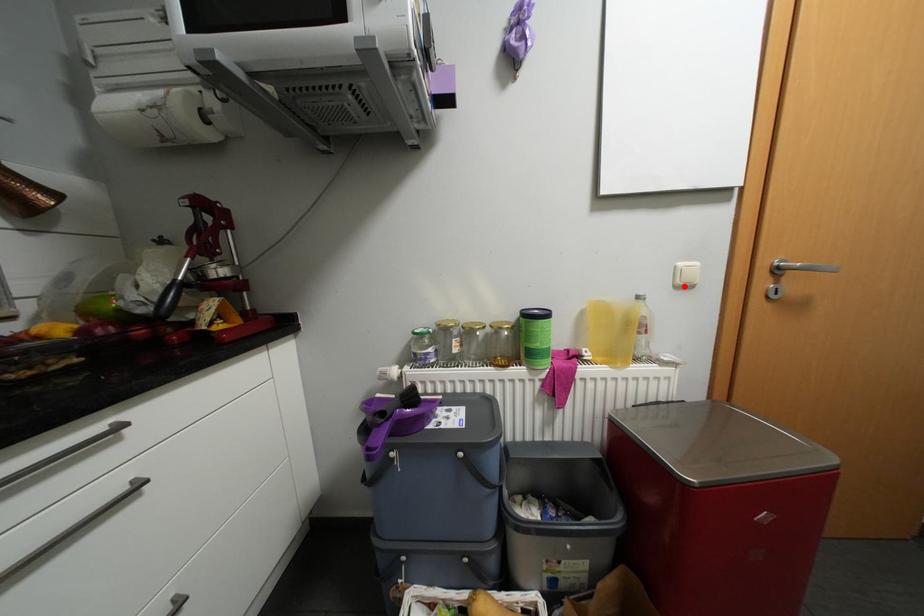
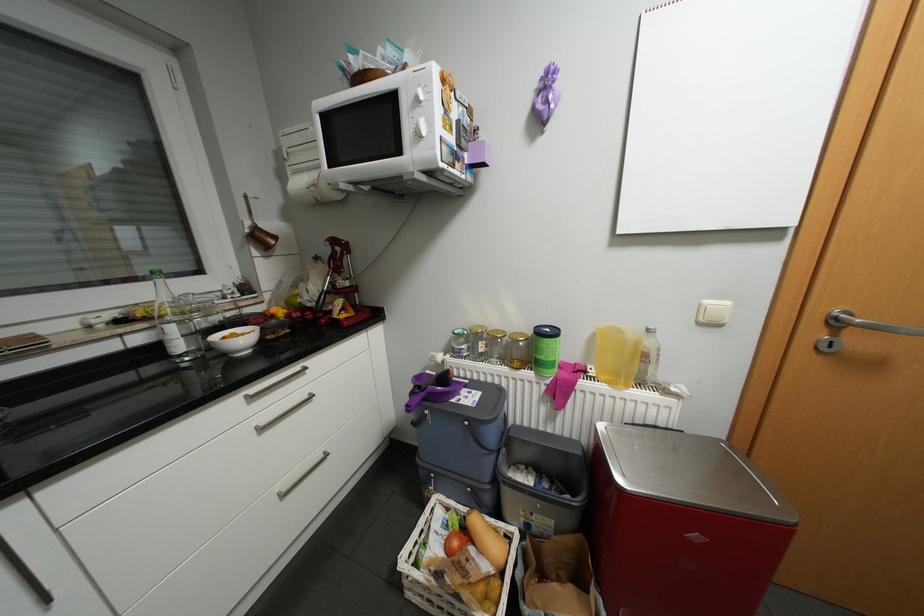
Where in the second image is the point corresponding to the highlighted location from the first image?

(708, 323)